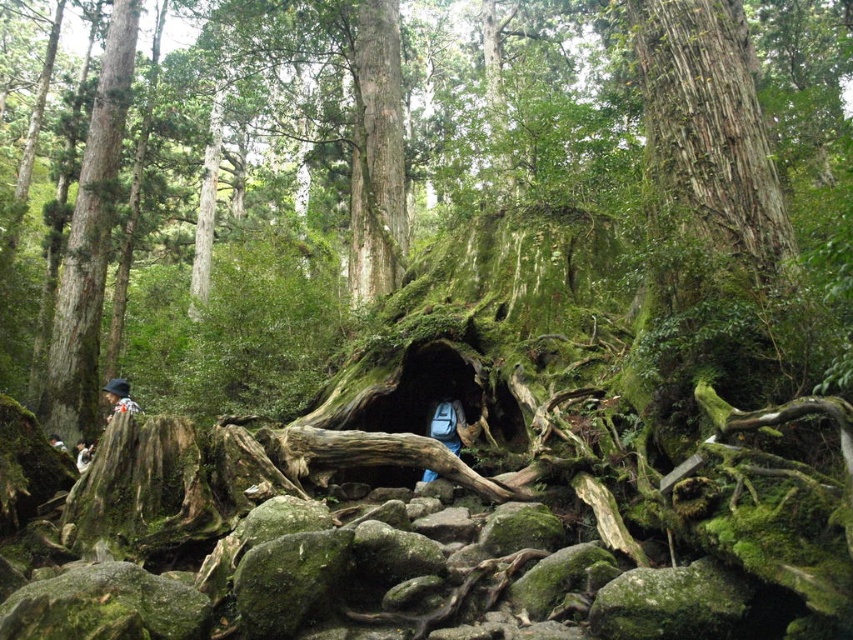
You are a hiker who has lost your way in the forest. You see the green mossy tree trunk at center and the camouflage jacket at left. Which object is closer to you?

The green mossy tree trunk at center is closer to you because it is in front of the camouflage jacket at left.

You are a hiker who has lost your way in the forest. You see a green mossy tree trunk at center and a camouflage jacket at left. Which object is closer to your left side?

The camouflage jacket at left is closer to your left side because it is positioned to the left of the green mossy tree trunk at center.

You are hiking in the forest and need to retrieve your light brown leather jacket at lower left. However, your blue fabric backpack at center is blocking the way. Can you easily access the jacket without moving the backpack?

The blue fabric backpack at center is above the light brown leather jacket at lower left, so you can easily access the jacket without moving the backpack since it is positioned below the backpack.